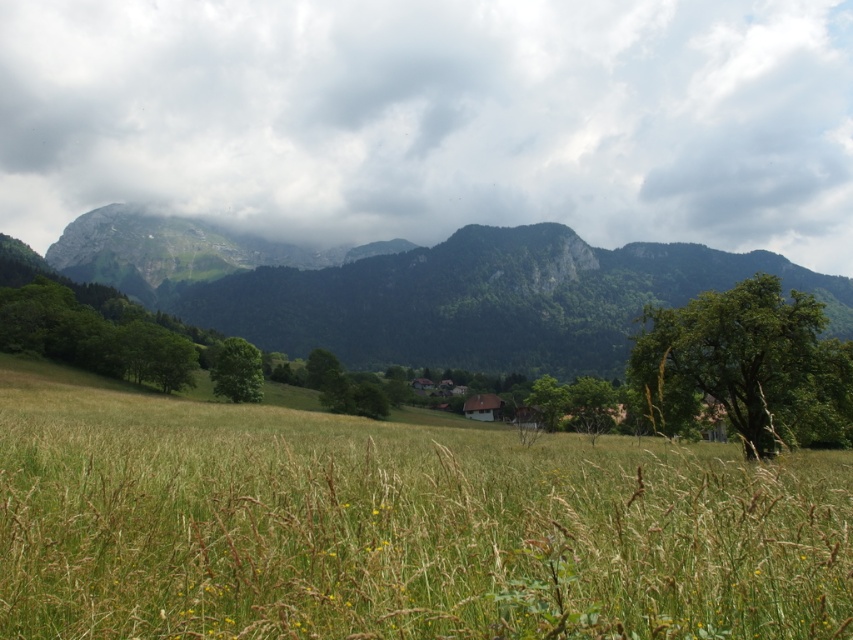
This screenshot has width=853, height=640. Find the location of `green rocky mountain at center`. green rocky mountain at center is located at coordinates (421, 289).

Does green rocky mountain at center appear over green leafy tree at right?

Yes.

Is point (611, 310) in front of point (764, 451)?

No.

Where is `green rocky mountain at center`? The image size is (853, 640). green rocky mountain at center is located at coordinates (421, 289).

Who is higher up, green grass at center or green leafy tree at right?

green leafy tree at right is above.

Which is in front, point (241, 532) or point (773, 353)?

Positioned in front is point (241, 532).

Is point (724, 454) positioned after point (712, 310)?

Yes, point (724, 454) is farther from viewer.

I want to click on green grass at center, so click(395, 525).

Does green rocky mountain at center come in front of green leafy tree at center?

Yes, it is.

Measure the distance between point (473,362) and camera.

The distance of point (473,362) from camera is 950.62 feet.

Is point (469, 362) more distant than point (238, 390)?

That is True.

Where is `green rocky mountain at center`? The width and height of the screenshot is (853, 640). green rocky mountain at center is located at coordinates (421, 289).